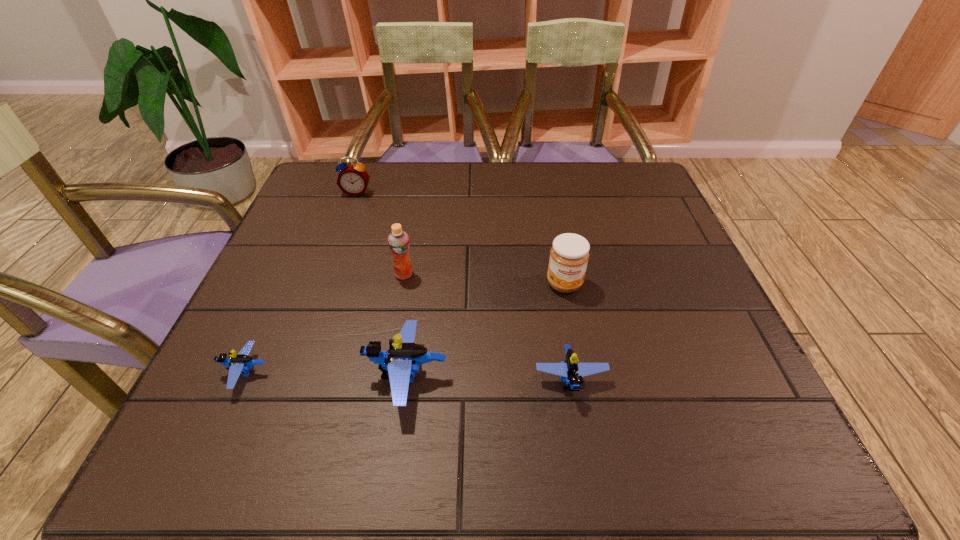
You are a GUI agent. You are given a task and a screenshot of the screen. Output one action in this format:
    pyautogui.click(x=<x>, y=<y>)
    Task: Click on the free space between the tallest Lego and the second tallest Lego
    This screenshot has width=960, height=540.
    Given the screenshot: What is the action you would take?
    pyautogui.click(x=489, y=378)

Where is `blank region between the tallest object and the rightmost Lego`? Image resolution: width=960 pixels, height=540 pixels. blank region between the tallest object and the rightmost Lego is located at coordinates (487, 327).

You are a GUI agent. You are given a task and a screenshot of the screen. Output one action in this format:
    pyautogui.click(x=<x>, y=<y>)
    Task: Click on the free space between the second shortest object and the jam
    This screenshot has width=960, height=540.
    Given the screenshot: What is the action you would take?
    pyautogui.click(x=567, y=332)

Find the location of a particular element. The image size is (960, 540). unoccupied area between the second Lego from left to right and the shortest Lego is located at coordinates (326, 375).

Identify the location of free space that is in between the jam and the tallest Lego. The image size is (960, 540). (486, 330).

Find the location of `vacant area that lies between the second Lego from right to left and the second tallest Lego`. vacant area that lies between the second Lego from right to left and the second tallest Lego is located at coordinates (489, 378).

Locate an element on the screen. object that stands as the fifth closest to the alarm clock is located at coordinates (570, 371).

The image size is (960, 540). I want to click on object that can be found as the fifth closest to the tallest Lego, so click(x=353, y=179).

Point out which Lego is positioned as the second nearest to the fifth object from right to left. Please provide its 2D coordinates. Your answer should be formatted as a tuple, i.e. [(x, y)], where the tuple contains the x and y coordinates of a point satisfying the conditions above.

[(239, 364)]

I want to click on Lego that is the third closest to the jam, so click(x=239, y=364).